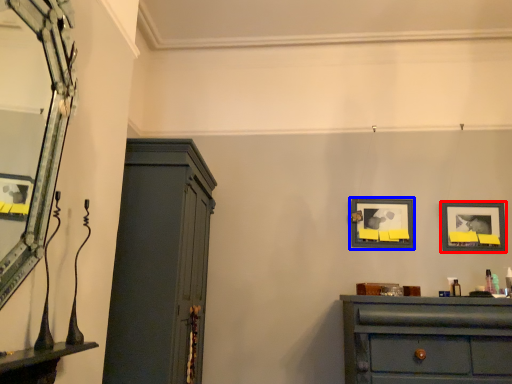
Question: Which object appears farthest to the camera in this image, picture frame (highlighted by a red box) or picture frame (highlighted by a blue box)?

Choices:
 (A) picture frame
 (B) picture frame

Answer: (B)